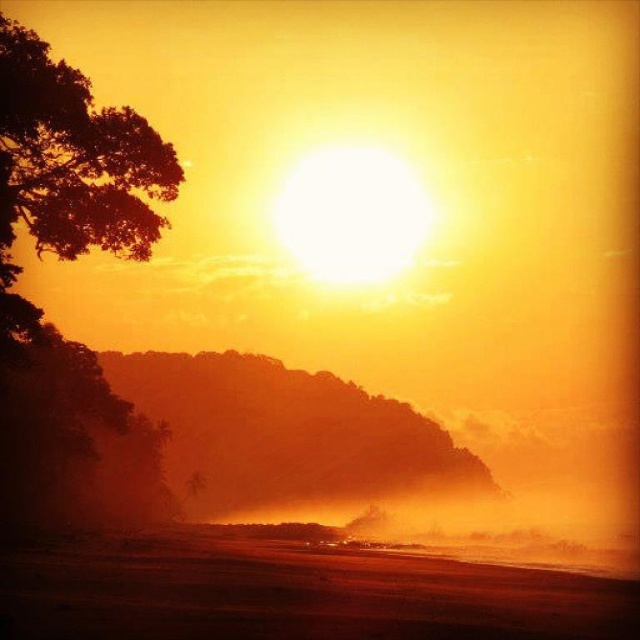
Question: Which point is farther to the camera?

Choices:
 (A) sandy shore at lower center
 (B) silhouetted leafy tree at left

Answer: (B)

Question: Which point is closer to the camera taking this photo?

Choices:
 (A) (33, 593)
 (B) (93, 125)

Answer: (A)

Question: Does sandy shore at lower center appear on the left side of silhouetted leafy tree at left?

Choices:
 (A) no
 (B) yes

Answer: (A)

Question: Is sandy shore at lower center to the right of silhouetted leafy tree at left from the viewer's perspective?

Choices:
 (A) yes
 (B) no

Answer: (A)

Question: Where is sandy shore at lower center located in relation to silhouetted leafy tree at left in the image?

Choices:
 (A) right
 (B) left

Answer: (A)